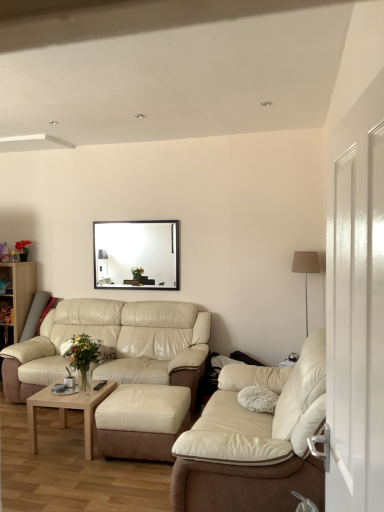
Question: Does black glossy picture frame at upper center appear on the left side of beige leather couch at lower left, the first studio couch positioned from the back?

Choices:
 (A) no
 (B) yes

Answer: (A)

Question: From the image's perspective, is black glossy picture frame at upper center above beige leather couch at lower left, positioned as the 2th studio couch in front-to-back order?

Choices:
 (A) yes
 (B) no

Answer: (A)

Question: Is black glossy picture frame at upper center beside beige leather couch at lower left, marked as the first studio couch in a left-to-right arrangement?

Choices:
 (A) no
 (B) yes

Answer: (A)

Question: Considering the relative sizes of black glossy picture frame at upper center and beige leather couch at lower left, positioned as the 2th studio couch in front-to-back order, in the image provided, is black glossy picture frame at upper center thinner than beige leather couch at lower left, positioned as the 2th studio couch in front-to-back order,?

Choices:
 (A) yes
 (B) no

Answer: (A)

Question: Is black glossy picture frame at upper center positioned behind beige leather couch at lower left, marked as the first studio couch in a left-to-right arrangement?

Choices:
 (A) no
 (B) yes

Answer: (B)

Question: Is black glossy picture frame at upper center taller than beige leather couch at lower left, the 2th studio couch in the right-to-left sequence?

Choices:
 (A) yes
 (B) no

Answer: (B)

Question: Can you confirm if beige leather couch at lower left, marked as the first studio couch in a left-to-right arrangement, is wider than white glossy door at right?

Choices:
 (A) no
 (B) yes

Answer: (B)

Question: Can you confirm if beige leather couch at lower left, marked as the first studio couch in a left-to-right arrangement, is bigger than white glossy door at right?

Choices:
 (A) no
 (B) yes

Answer: (B)

Question: From the image's perspective, is beige leather couch at lower left, the 2th studio couch in the right-to-left sequence, above white glossy door at right?

Choices:
 (A) no
 (B) yes

Answer: (A)

Question: Considering the relative sizes of beige leather couch at lower left, the first studio couch positioned from the back, and white glossy door at right in the image provided, is beige leather couch at lower left, the first studio couch positioned from the back, shorter than white glossy door at right?

Choices:
 (A) yes
 (B) no

Answer: (A)

Question: Is beige leather couch at lower left, the first studio couch positioned from the back, far from white glossy door at right?

Choices:
 (A) yes
 (B) no

Answer: (A)

Question: From a real-world perspective, is beige leather couch at lower left, the 2th studio couch in the right-to-left sequence, positioned over white glossy door at right based on gravity?

Choices:
 (A) yes
 (B) no

Answer: (B)

Question: Is beige leather couch at lower left, the first studio couch positioned from the back, located outside wooden bookshelf at left?

Choices:
 (A) yes
 (B) no

Answer: (A)